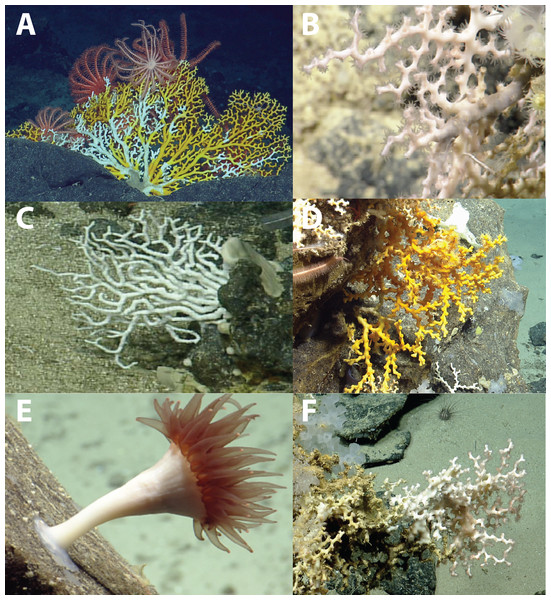
Locate an element on the screen. greenish gray background color is located at coordinates (133, 445).